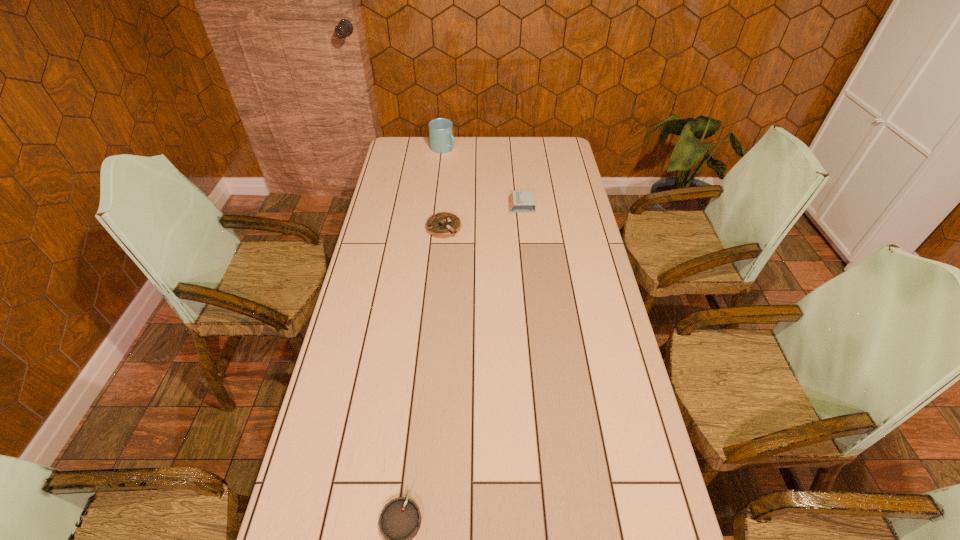
The image size is (960, 540). I want to click on free space at the far edge of the desktop, so click(x=511, y=149).

Locate an element on the screen. vacant region at the left edge is located at coordinates (368, 240).

The width and height of the screenshot is (960, 540). In the image, there is a desktop. Identify the location of vacant space at the right edge. (557, 175).

The height and width of the screenshot is (540, 960). What are the coordinates of `blank space at the far left corner of the desktop` in the screenshot? It's located at [421, 159].

Identify the location of free space that is in between the mug and the alarm clock. The width and height of the screenshot is (960, 540). (482, 177).

This screenshot has height=540, width=960. I want to click on empty space between the alarm clock and the tallest object, so click(x=482, y=177).

In order to click on vacant space that is in between the third nearest object and the farthest object in this screenshot , I will do `click(482, 177)`.

Locate an element on the screen. This screenshot has width=960, height=540. free spot between the mug and the alarm clock is located at coordinates (482, 177).

Select which object appears as the closest to the alarm clock. Please provide its 2D coordinates. Your answer should be formatted as a tuple, i.e. [(x, y)], where the tuple contains the x and y coordinates of a point satisfying the conditions above.

[(442, 225)]

Identify the location of the second closest object relative to the rightmost object. This screenshot has height=540, width=960. (442, 141).